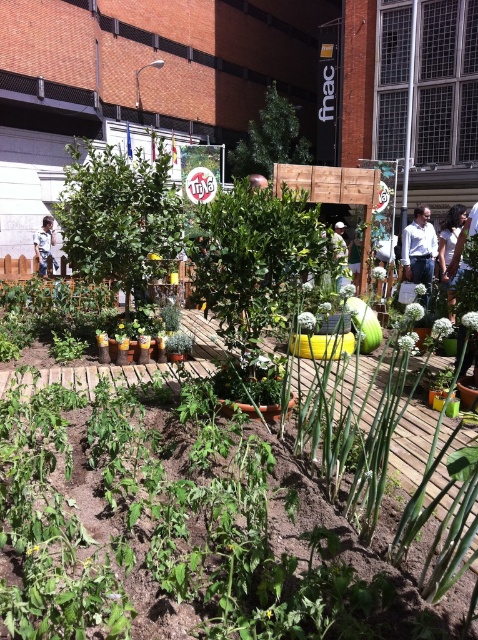
Question: Does light blue shirt at upper right appear on the left side of green matte squash at center?

Choices:
 (A) yes
 (B) no

Answer: (B)

Question: Is the position of dark brown hair at center less distant than that of light blue shirt at center?

Choices:
 (A) no
 (B) yes

Answer: (B)

Question: Which of the following is the farthest from the observer?

Choices:
 (A) green matte squash at center
 (B) dark brown hair at center
 (C) light blue shirt at center
 (D) light blue shirt at upper right

Answer: (C)

Question: From the image, what is the correct spatial relationship of dark brown hair at center in relation to light blue shirt at center?

Choices:
 (A) left
 (B) right

Answer: (B)

Question: Based on their relative distances, which object is farther from the light blue shirt at upper right?

Choices:
 (A) light blue shirt at center
 (B) dark brown hair at center
 (C) green matte squash at center

Answer: (A)

Question: Which point is farther to the camera?

Choices:
 (A) green matte squash at center
 (B) dark brown hair at center
 (C) light blue shirt at center

Answer: (C)